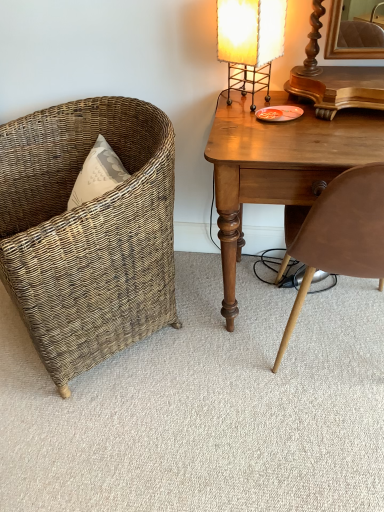
In order to click on vacant space in wooden desk at right (from a real-world perspective) in this screenshot , I will do `click(278, 287)`.